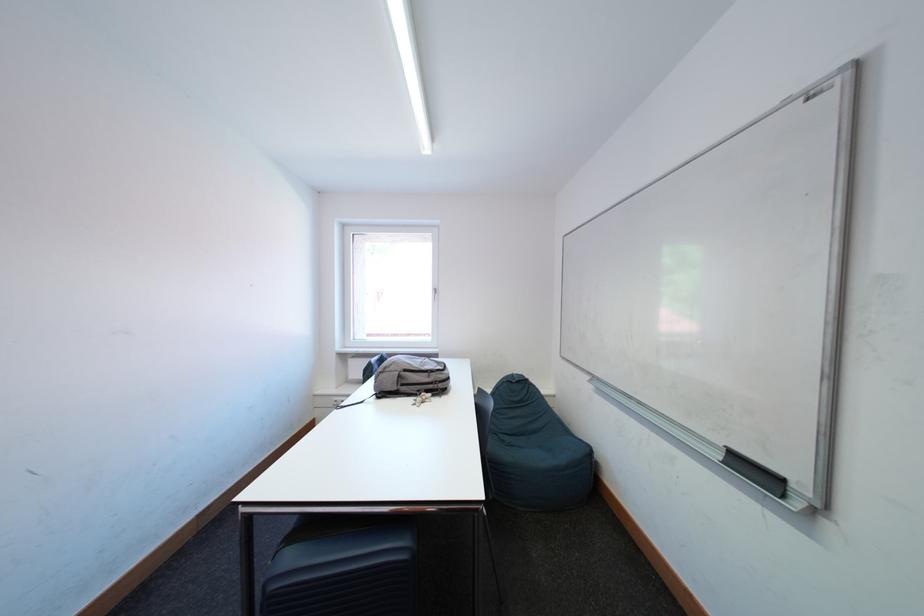
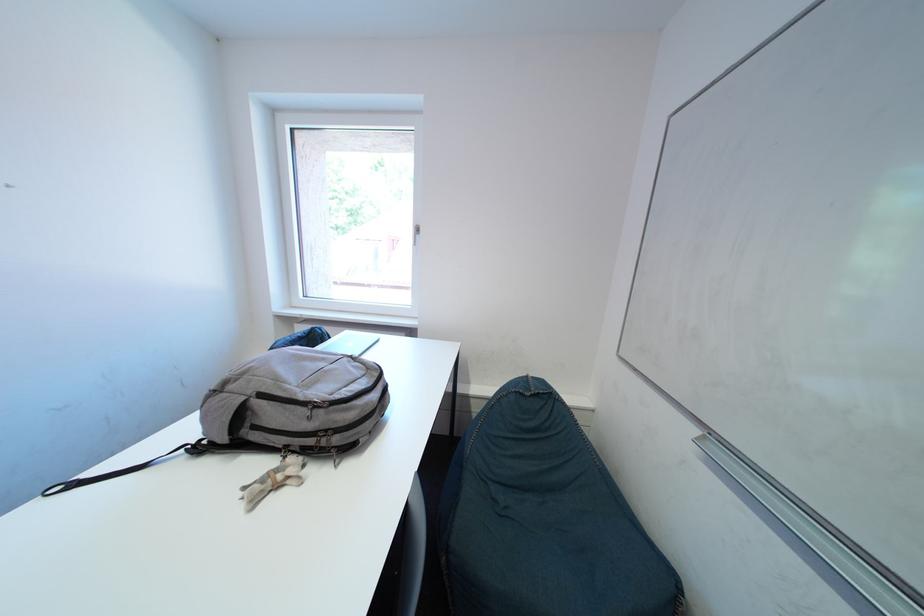
Question: What movement of the cameraman would produce the second image?

Choices:
 (A) Left
 (B) Right
 (C) Forward
 (D) Backward

Answer: (C)